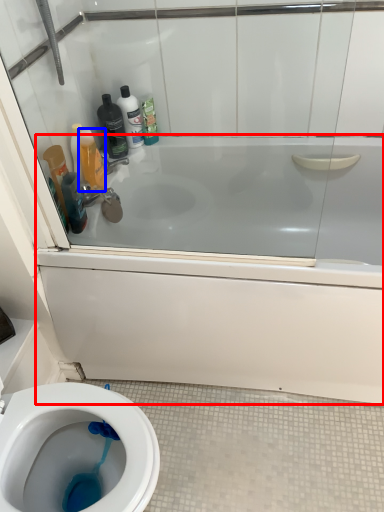
Question: Which object is closer to the camera taking this photo, bath (highlighted by a red box) or cleaning product (highlighted by a blue box)?

Choices:
 (A) bath
 (B) cleaning product

Answer: (A)